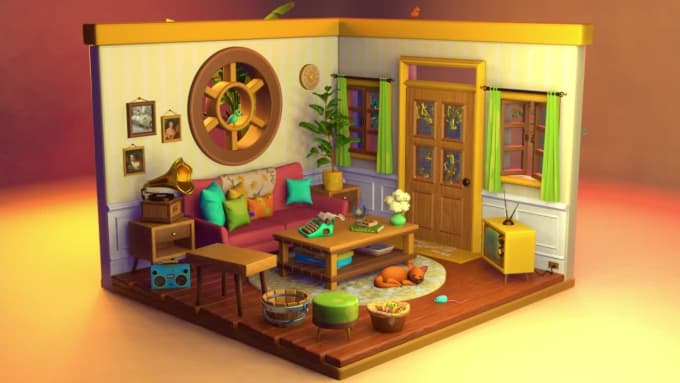
This screenshot has height=383, width=680. What are the coordinates of `handle` in the screenshot? It's located at (466, 182).